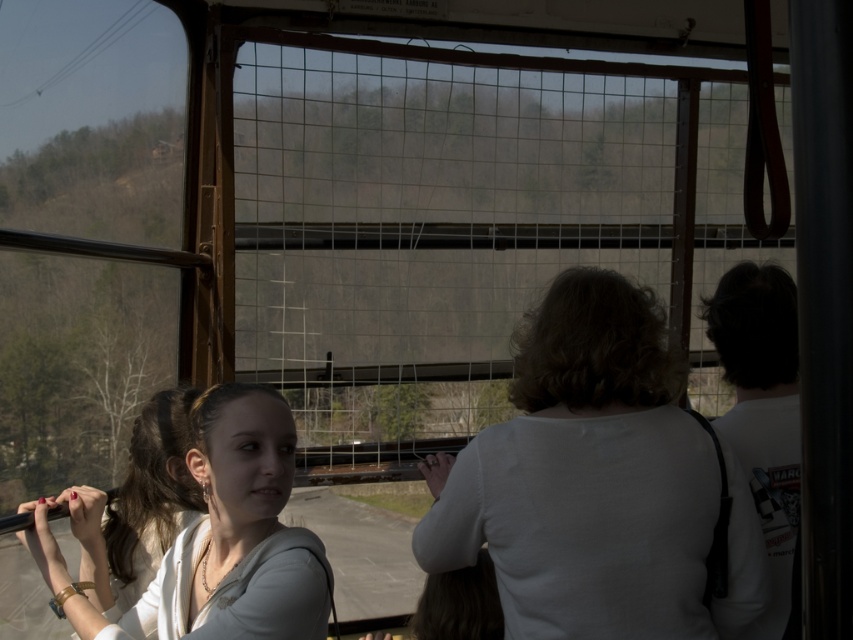
Between matte white shirt at left and white matte shirt at right, which one has more height?

white matte shirt at right is taller.

Can you confirm if matte white shirt at left is positioned below white matte shirt at right?

Indeed, matte white shirt at left is positioned under white matte shirt at right.

Locate an element on the screen. This screenshot has width=853, height=640. matte white shirt at left is located at coordinates (209, 538).

The height and width of the screenshot is (640, 853). Identify the location of matte white shirt at left. (209, 538).

Does white matte shirt at center have a greater height compared to matte white shirt at left?

Indeed, white matte shirt at center has a greater height compared to matte white shirt at left.

You are a GUI agent. You are given a task and a screenshot of the screen. Output one action in this format:
    pyautogui.click(x=<x>, y=<y>)
    Task: Click on the white matte shirt at center
    
    Given the screenshot: What is the action you would take?
    pyautogui.click(x=595, y=483)

This screenshot has height=640, width=853. In order to click on white matte shirt at center in this screenshot , I will do `click(595, 483)`.

How distant is white matte shirt at center from white matte shirt at right?

They are 20.80 inches apart.

I want to click on white matte shirt at center, so [x=595, y=483].